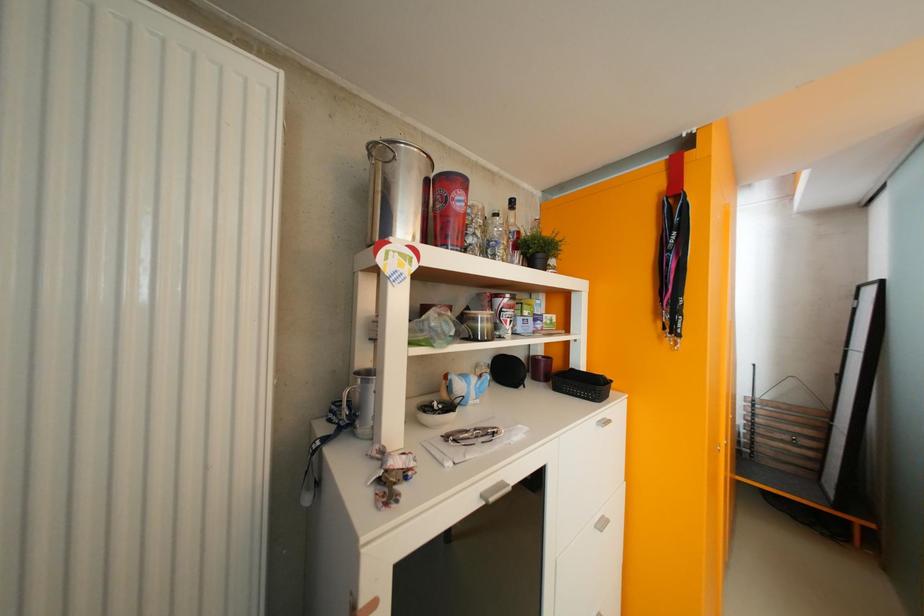
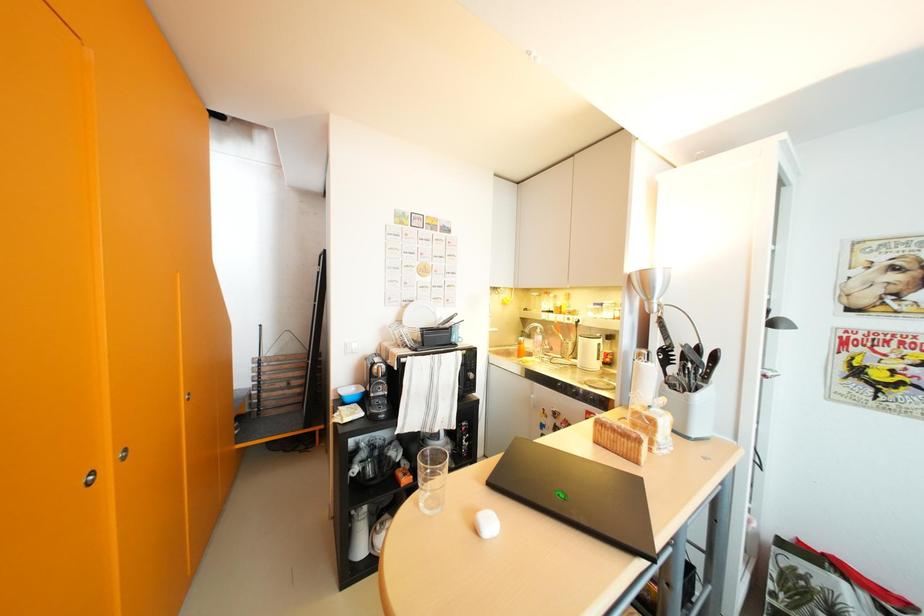
Question: Based on the continuous images, in which direction is the camera rotating? Reply with the corresponding letter.

Choices:
 (A) Left
 (B) Right
 (C) Up
 (D) Down

Answer: (B)